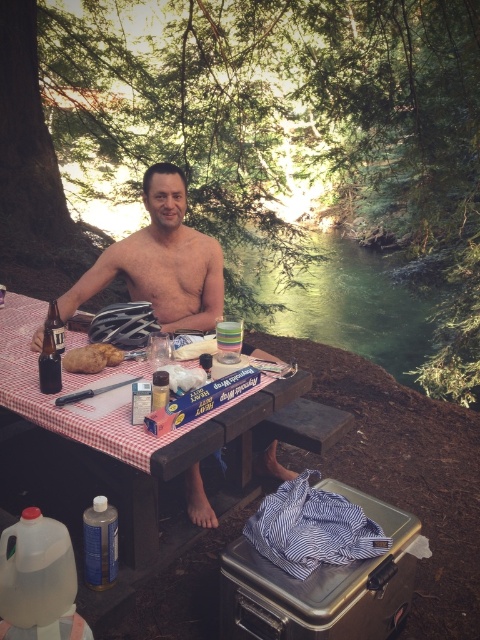
You are planning to place a large salad bowl on the wooden picnic table at center. The brown crumbly bread at table front is currently occupying the space. Can you fit the salad bowl on the table without moving the bread?

The wooden picnic table at center might be wider than brown crumbly bread at table front, so there could be enough space to place the salad bowl without moving the bread. However, it depends on the exact dimensions of both the table and the bowl.